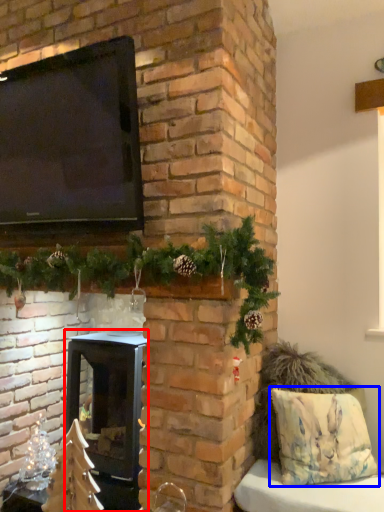
Question: Which point is further to the camera, wood burning stove (highlighted by a red box) or pillow (highlighted by a blue box)?

Choices:
 (A) wood burning stove
 (B) pillow

Answer: (A)